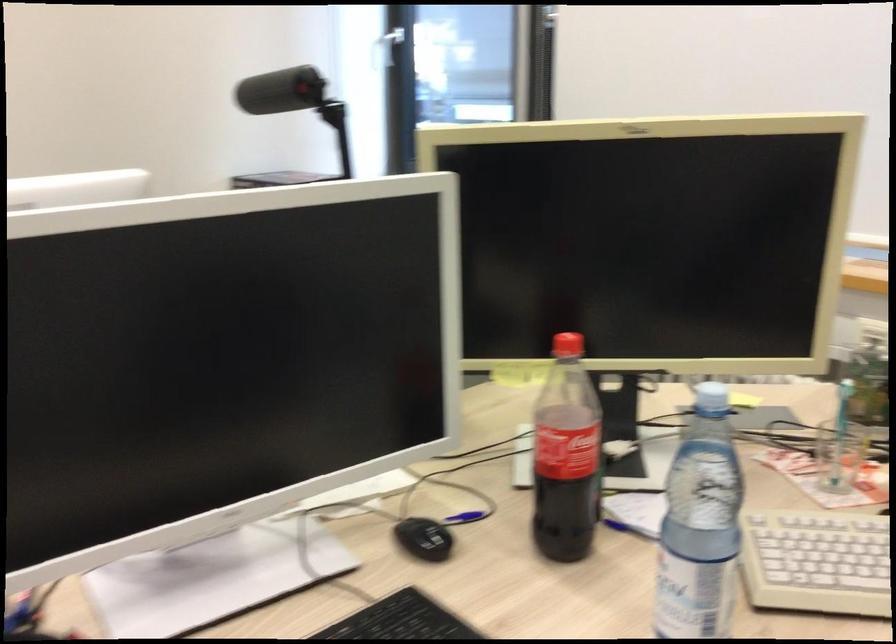
Where is `blue bottle cap`? The height and width of the screenshot is (644, 896). blue bottle cap is located at coordinates (711, 398).